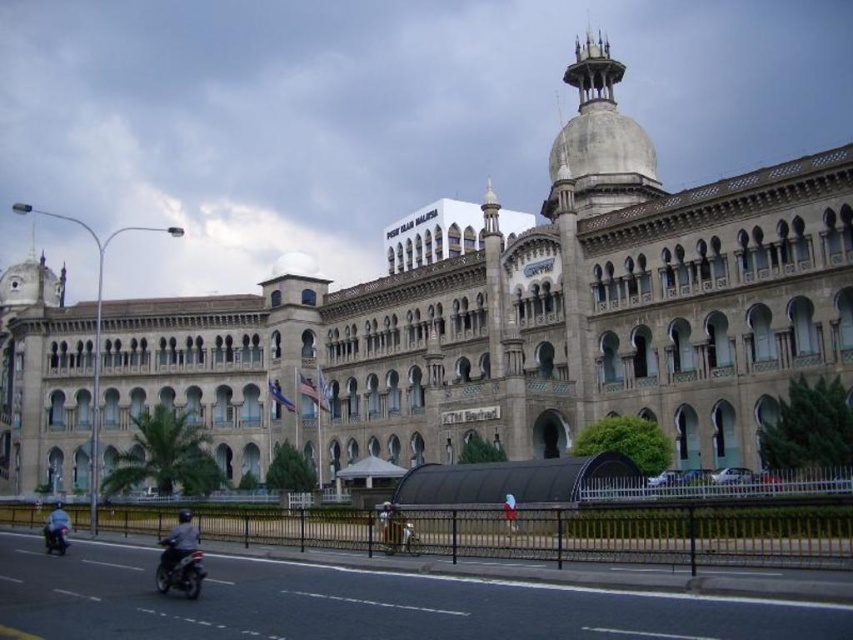
Question: Which point is farther from the camera taking this photo?

Choices:
 (A) (193, 525)
 (B) (198, 561)

Answer: (A)

Question: Can you confirm if black matte motorbike at lower left is positioned below blue fabric helmet at lower left?

Choices:
 (A) no
 (B) yes

Answer: (A)

Question: Which point appears farthest from the camera in this image?

Choices:
 (A) (183, 531)
 (B) (59, 532)
 (C) (167, 560)

Answer: (B)

Question: Does gray matte jacket on the left have a smaller size compared to blue fabric helmet at lower left?

Choices:
 (A) yes
 (B) no

Answer: (B)

Question: Which point is closer to the camera taking this photo?

Choices:
 (A) [51, 522]
 (B) [161, 561]
 (C) [161, 564]

Answer: (C)

Question: Does gray matte jacket on the left have a lesser width compared to blue fabric helmet at lower left?

Choices:
 (A) yes
 (B) no

Answer: (A)